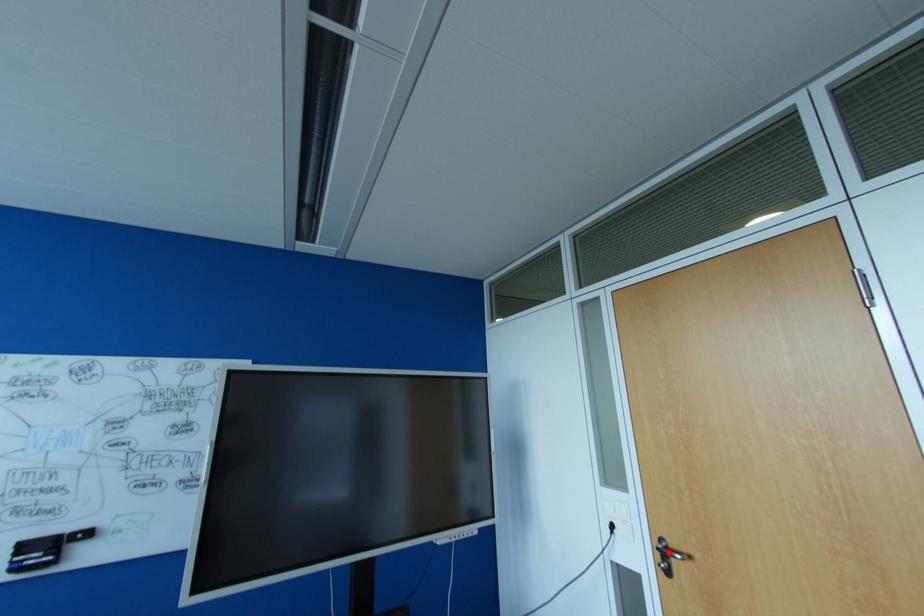
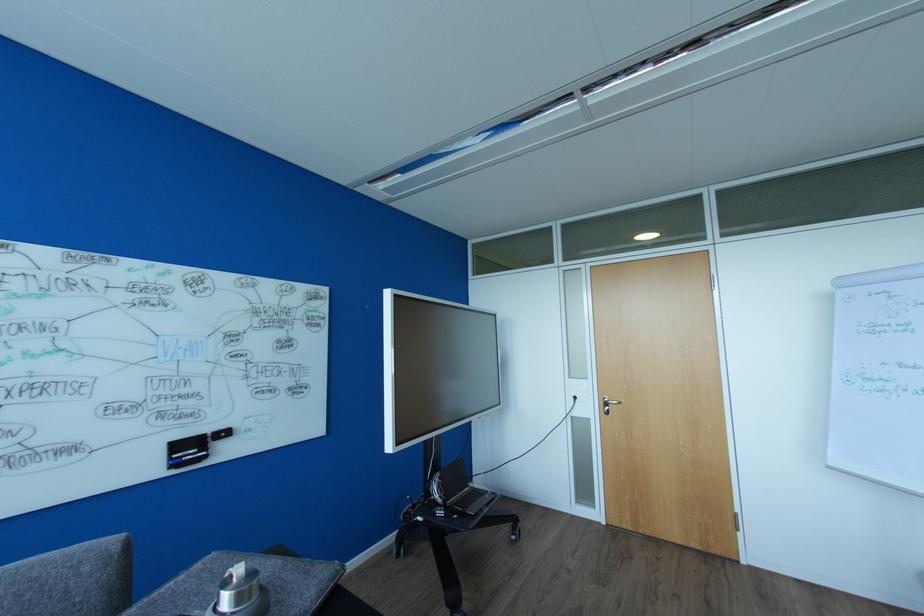
Where in the second image is the point corresponding to the highlighted location from the first image?

(610, 403)